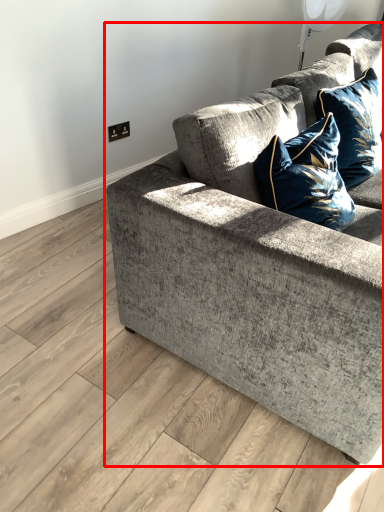
Question: In this image, where is studio couch (annotated by the red box) located relative to pillow?

Choices:
 (A) right
 (B) left

Answer: (A)